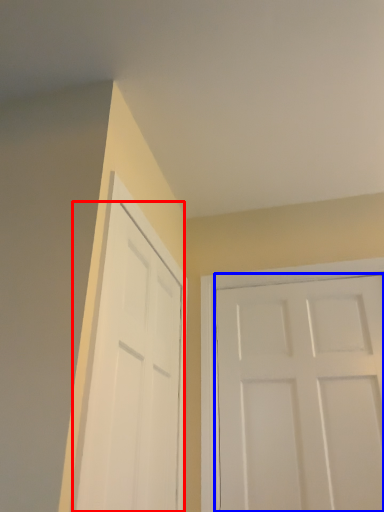
Question: Which of the following is the closest to the observer, door (highlighted by a red box) or door (highlighted by a blue box)?

Choices:
 (A) door
 (B) door

Answer: (A)